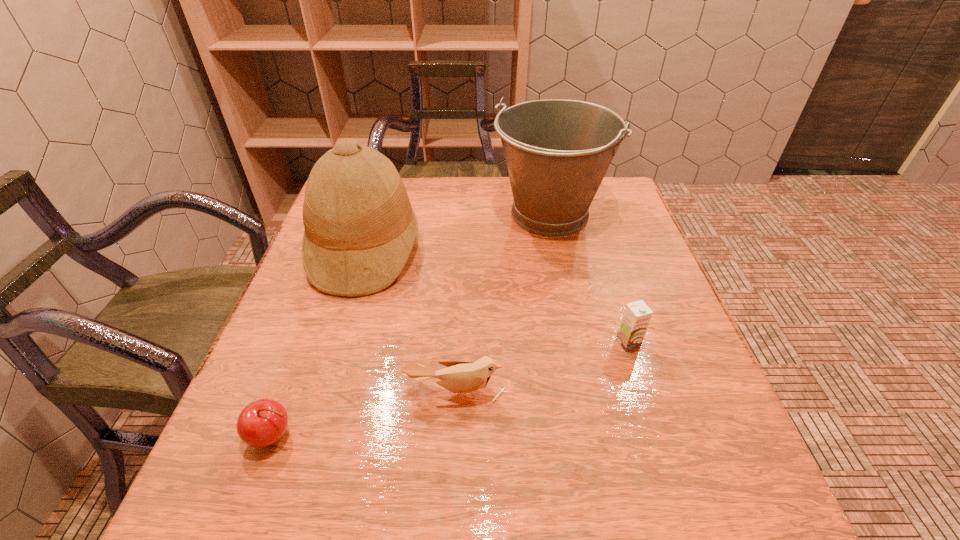
This screenshot has width=960, height=540. Find the location of `vacant space at the left edge of the desktop`. vacant space at the left edge of the desktop is located at coordinates (308, 440).

Image resolution: width=960 pixels, height=540 pixels. In order to click on vacant space at the right edge of the desktop in this screenshot , I will do `click(621, 319)`.

Locate an element on the screen. The width and height of the screenshot is (960, 540). empty space between the nearest object and the hat is located at coordinates (320, 342).

At what (x,y) coordinates should I click in order to perform the action: click on vacant space that is in between the hat and the cherry. Please return your answer as a coordinate pair (x, y). The image size is (960, 540). Looking at the image, I should click on (320, 342).

This screenshot has height=540, width=960. In order to click on vacant area that lies between the bird and the cherry in this screenshot , I will do `click(366, 414)`.

Where is `unoccupied area between the hat and the second nearest object`? Image resolution: width=960 pixels, height=540 pixels. unoccupied area between the hat and the second nearest object is located at coordinates (411, 321).

The image size is (960, 540). I want to click on empty space between the chocolate milk and the bird, so click(x=542, y=368).

In order to click on vacant area between the hat and the bucket in this screenshot , I will do `click(457, 232)`.

Locate an element on the screen. The image size is (960, 540). free point between the fourth farthest object and the hat is located at coordinates (411, 321).

Locate an element on the screen. The height and width of the screenshot is (540, 960). free point between the hat and the fourth farthest object is located at coordinates (411, 321).